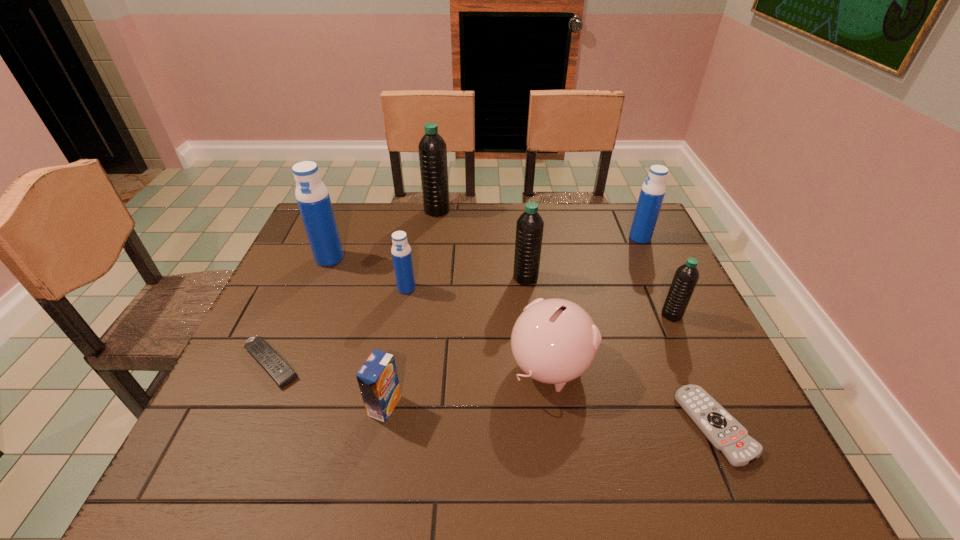
The width and height of the screenshot is (960, 540). I want to click on the farthest water bottle, so click(432, 148).

Identify the location of the farthest black water bottle. (432, 148).

Identify the location of the second farthest blue water bottle. The width and height of the screenshot is (960, 540). (312, 196).

I want to click on the biggest blue water bottle, so click(312, 196).

This screenshot has width=960, height=540. Identify the location of the second biggest blue water bottle. (652, 193).

The image size is (960, 540). Identify the location of the fifth nearest water bottle. (652, 193).

I want to click on the second farthest black water bottle, so click(x=529, y=229).

The image size is (960, 540). I want to click on the third water bottle from right to left, so click(529, 229).

Where is `the rightmost black water bottle`? Image resolution: width=960 pixels, height=540 pixels. the rightmost black water bottle is located at coordinates (686, 276).

What are the coordinates of `the nearest black water bottle` in the screenshot? It's located at (686, 276).